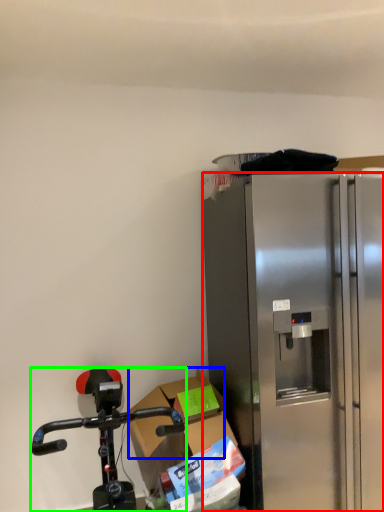
Question: Which object is the closest to the refrigerator (highlighted by a red box)? Choose among these: box (highlighted by a blue box) or bicycle (highlighted by a green box).

Choices:
 (A) box
 (B) bicycle

Answer: (A)